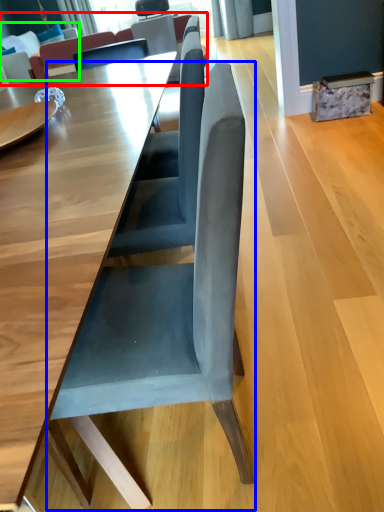
Question: Based on their relative distances, which object is farther from couch (highlighted by a red box)? Choose from chair (highlighted by a blue box) and couch (highlighted by a green box).

Choices:
 (A) chair
 (B) couch

Answer: (A)